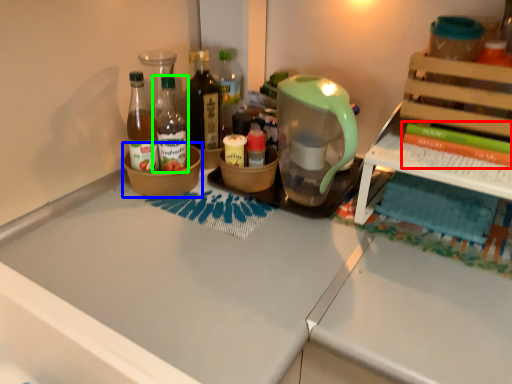
Question: Considering the real-world distances, which object is farthest from book (highlighted by a red box)? bowl (highlighted by a blue box) or bottle (highlighted by a green box)?

Choices:
 (A) bowl
 (B) bottle

Answer: (B)